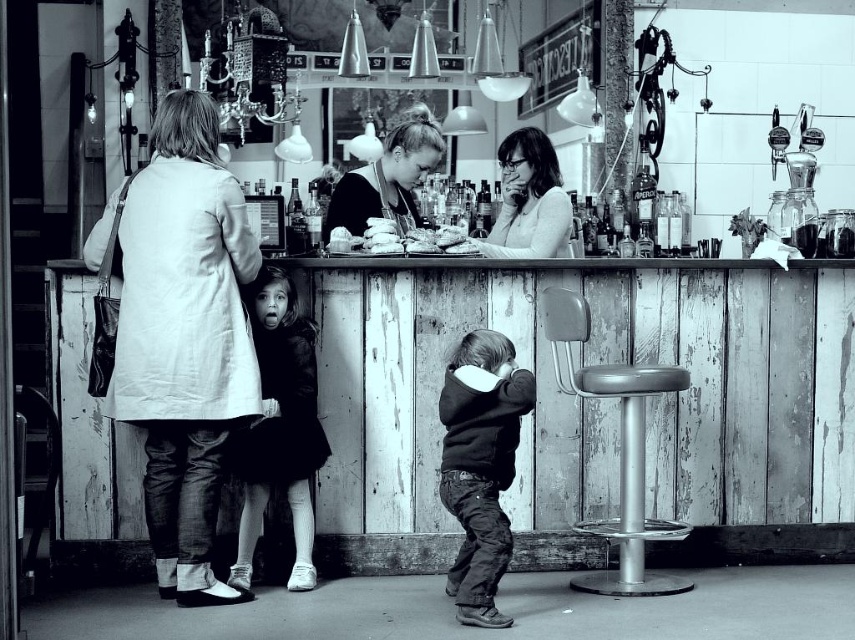
You are standing at the entrance of the bar and want to approach the dark gray hoodie at center and the metallic silver stool at lower right. Which object will you encounter first as you move forward?

The dark gray hoodie at center will be encountered first because it is closer to the viewer than the metallic silver stool at lower right.

You are a photographer taking a black and white photo of the scene. You need to place a small decorative item exactly between the dark fur coat at center and the smooth white bread at center. Based on their positions, where should you place the item?

The dark fur coat at center is to the left of the smooth white bread at center, so you should place the item between them along the horizontal axis, equidistant from both objects.